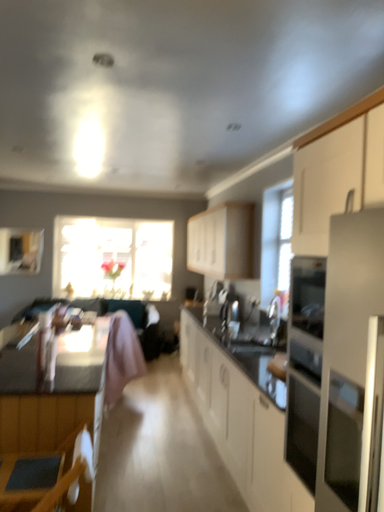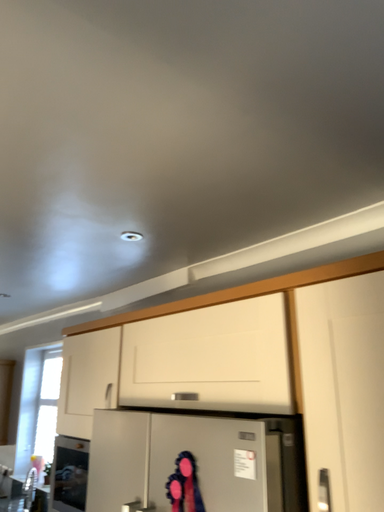
Question: How did the camera likely rotate when shooting the video?

Choices:
 (A) rotated right
 (B) rotated left

Answer: (A)